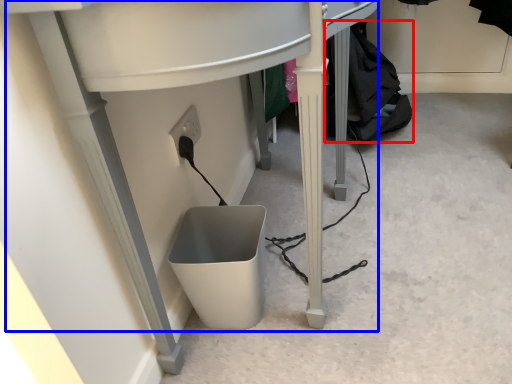
Question: Which object appears farthest to the camera in this image, clothing (highlighted by a red box) or computer desk (highlighted by a blue box)?

Choices:
 (A) clothing
 (B) computer desk

Answer: (A)